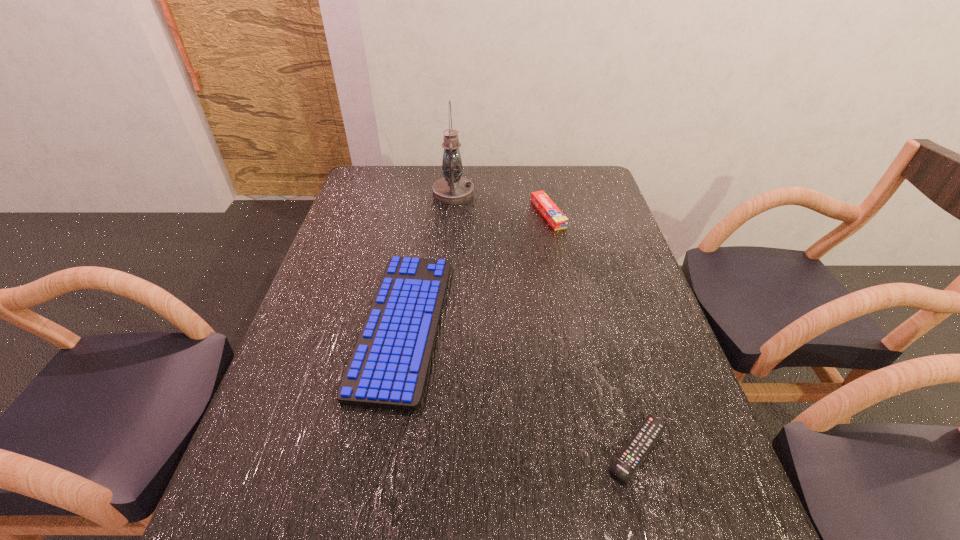
Where is `the tallest object`? The height and width of the screenshot is (540, 960). the tallest object is located at coordinates (452, 189).

Locate an element on the screen. toothpaste is located at coordinates click(553, 215).

The width and height of the screenshot is (960, 540). I want to click on computer keyboard, so click(x=388, y=368).

Where is `the third tallest object`? the third tallest object is located at coordinates (388, 368).

You are a GUI agent. You are given a task and a screenshot of the screen. Output one action in this format:
    pyautogui.click(x=<x>, y=<y>)
    Task: Click on the nearest object
    
    Given the screenshot: What is the action you would take?
    pyautogui.click(x=628, y=461)

Locate an element on the screen. The width and height of the screenshot is (960, 540). the shortest object is located at coordinates (628, 461).

The width and height of the screenshot is (960, 540). In order to click on free space located on the right of the oil lamp in this screenshot , I will do `click(502, 193)`.

Where is `vacant space positioned 0.060m on the right of the toothpaste`? Image resolution: width=960 pixels, height=540 pixels. vacant space positioned 0.060m on the right of the toothpaste is located at coordinates (581, 214).

This screenshot has width=960, height=540. I want to click on free region located on the front of the third farthest object, so click(376, 478).

At what (x,y) coordinates should I click in order to perform the action: click on free space located 0.220m on the back of the shortest object. Please return your answer as a coordinate pair (x, y). This screenshot has height=540, width=960. Looking at the image, I should click on (607, 336).